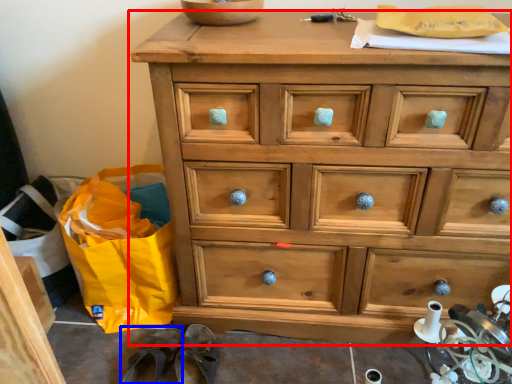
Question: Among these objects, which one is farthest to the camera, chest of drawers (highlighted by a red box) or slipper (highlighted by a blue box)?

Choices:
 (A) chest of drawers
 (B) slipper

Answer: (B)